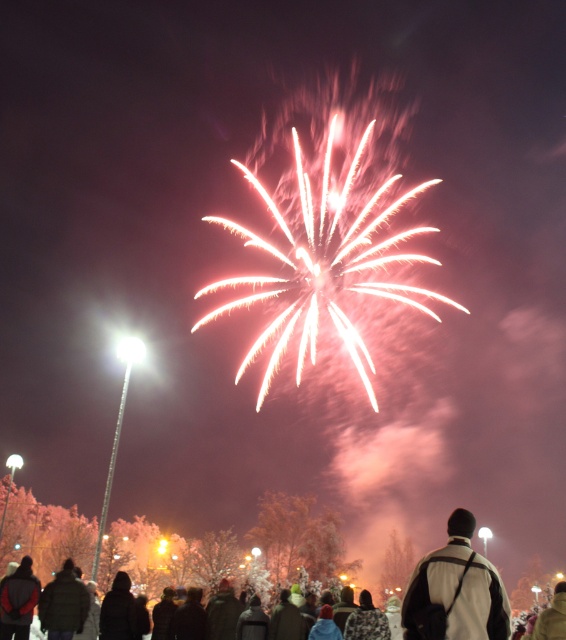
You are standing in the crowd watching the fireworks. You want to find the white matte jacket at center. Where would you look relative to the fireworks display?

The white matte jacket at center is located at the point 0.925 along the x axis and 0.806 along the y axis relative to the fireworks display.

You are a photographer trying to capture the fireworks display. You notice two jackets in the crowd. The white matte jacket at center and the dark brown leather jacket at lower left. Which jacket is closer to the fireworks? Please explain your reasoning based on their positions.

The white matte jacket at center is positioned over the dark brown leather jacket at lower left, meaning it is closer to the fireworks. Since the white matte jacket is in front, it would be nearer to the fireworks display compared to the dark brown leather jacket which is behind it.